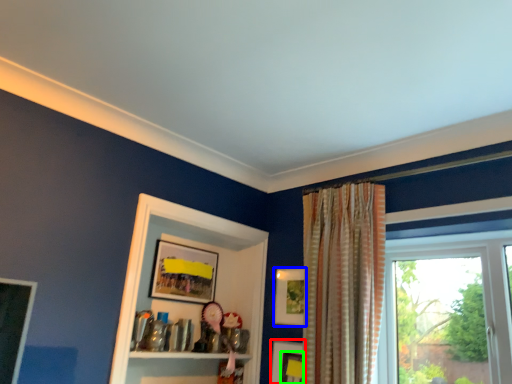
Question: Considering the real-world distances, which object is farthest from picture frame (highlighted by a red box)? picture frame (highlighted by a blue box) or picture frame (highlighted by a green box)?

Choices:
 (A) picture frame
 (B) picture frame

Answer: (A)